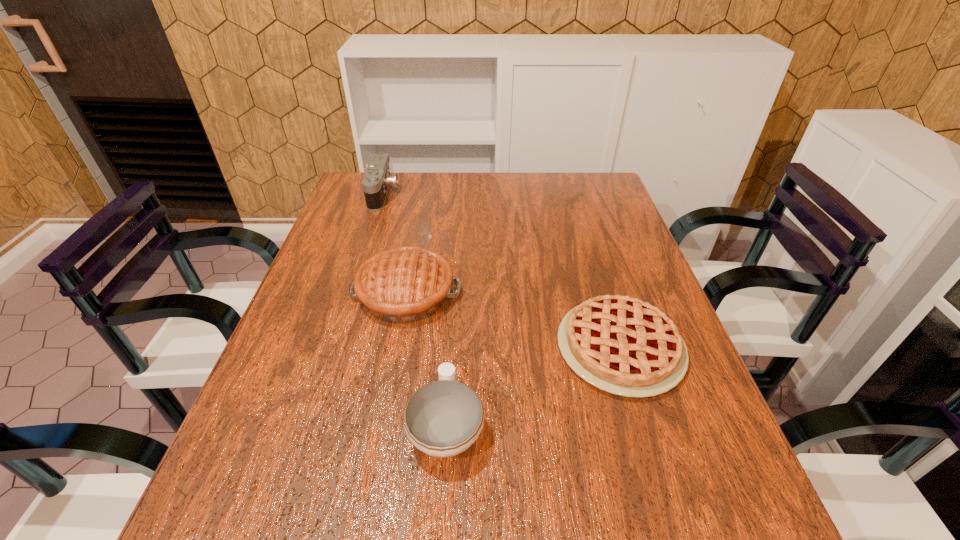
Where is `vacant region at the far right corner of the desktop`? The height and width of the screenshot is (540, 960). vacant region at the far right corner of the desktop is located at coordinates 585,187.

Where is `free space that is in between the shortest object and the third tallest object`? The image size is (960, 540). free space that is in between the shortest object and the third tallest object is located at coordinates (533, 387).

The width and height of the screenshot is (960, 540). I want to click on vacant space that is in between the shorter pie and the third tallest object, so click(533, 387).

Where is `vacant point located between the rightmost object and the chinaware`? Image resolution: width=960 pixels, height=540 pixels. vacant point located between the rightmost object and the chinaware is located at coordinates (533, 387).

Locate an element on the screen. The image size is (960, 540). vacant space in between the taller pie and the camera is located at coordinates [x=395, y=243].

Where is `vacant space that is in between the chinaware and the rightmost object`? This screenshot has height=540, width=960. vacant space that is in between the chinaware and the rightmost object is located at coordinates (533, 387).

Find the location of a particular element. This screenshot has width=960, height=540. vacant area that lies between the third tallest object and the taller pie is located at coordinates (426, 360).

This screenshot has width=960, height=540. Identify the location of free area in between the right pie and the taller pie. (513, 320).

What are the coordinates of `free spot between the left pie and the rightmost object` in the screenshot? It's located at (513, 320).

Identify which object is located as the third nearest to the left pie. Please provide its 2D coordinates. Your answer should be formatted as a tuple, i.e. [(x, y)], where the tuple contains the x and y coordinates of a point satisfying the conditions above.

[(377, 180)]